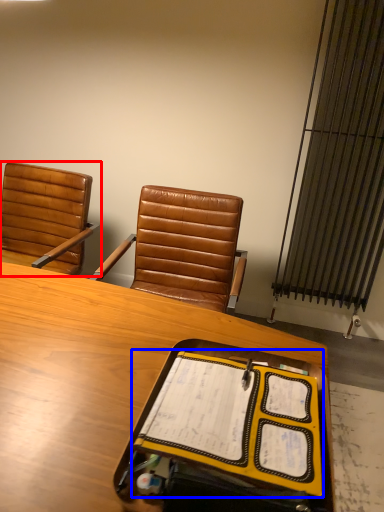
Question: Which of the following is the closest to the observer, chair (highlighted by a red box) or notebook (highlighted by a blue box)?

Choices:
 (A) chair
 (B) notebook

Answer: (B)